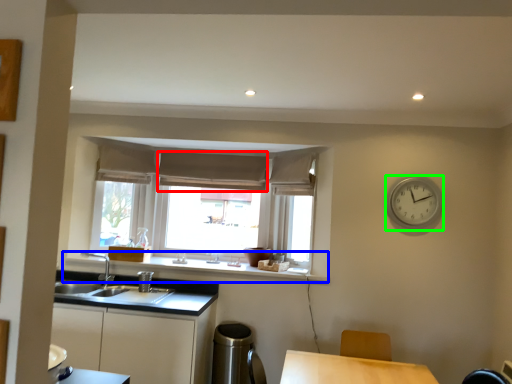
Question: Which object is the farthest from curtain (highlighted by a red box)? Choose among these: window sill (highlighted by a blue box) or clock (highlighted by a green box).

Choices:
 (A) window sill
 (B) clock

Answer: (B)